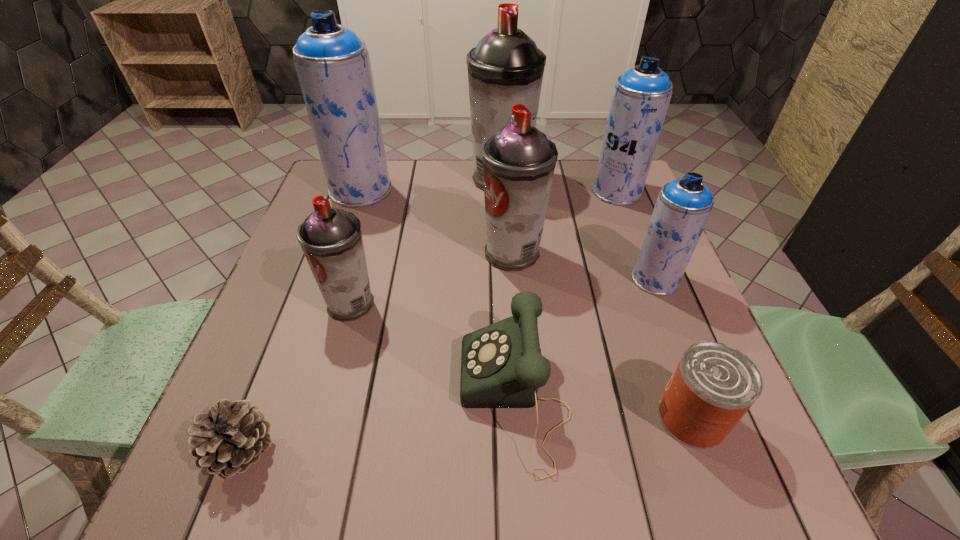
This screenshot has width=960, height=540. Find the location of `free space located on the right of the shortest object`. free space located on the right of the shortest object is located at coordinates (372, 450).

You are a GUI agent. You are given a task and a screenshot of the screen. Output one action in this format:
    pyautogui.click(x=<x>, y=<y>)
    Task: Click on the can at the near edge
    
    Given the screenshot: What is the action you would take?
    pyautogui.click(x=713, y=386)

Where is `telephone that is at the near edge`? telephone that is at the near edge is located at coordinates (501, 364).

At what (x,y) coordinates should I click in order to perform the action: click on pinecone located in the near edge section of the desktop. Please return your answer as a coordinate pair (x, y). Looking at the image, I should click on (231, 437).

At what (x,y) coordinates should I click in order to perform the action: click on pinecone at the left edge. Please return your answer as a coordinate pair (x, y). Looking at the image, I should click on (231, 437).

Locate an element on the screen. The width and height of the screenshot is (960, 540). can that is at the right edge is located at coordinates (713, 386).

Identify the location of object located at the far left corner. (333, 65).

At what (x,y) coordinates should I click in order to perform the action: click on object located in the near left corner section of the desktop. Please return your answer as a coordinate pair (x, y). The image size is (960, 540). Looking at the image, I should click on (231, 437).

At what (x,y) coordinates should I click in order to perform the action: click on object situated at the far right corner. Please return your answer as a coordinate pair (x, y). The height and width of the screenshot is (540, 960). Looking at the image, I should click on (641, 96).

Locate an element on the screen. The image size is (960, 540). object that is at the near right corner is located at coordinates [713, 386].